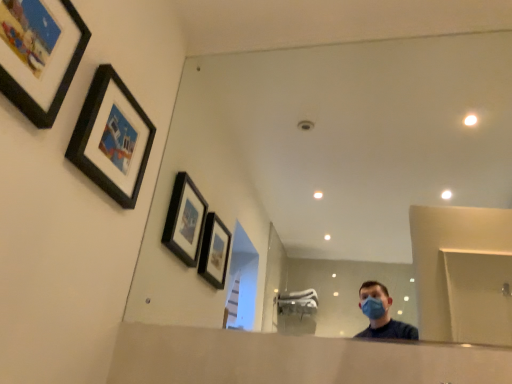
Question: Considering the relative sizes of clear glass mirror at center and matte black picture frame at upper left, arranged as the 2th picture frame when viewed from the back, in the image provided, is clear glass mirror at center bigger than matte black picture frame at upper left, arranged as the 2th picture frame when viewed from the back,?

Choices:
 (A) yes
 (B) no

Answer: (A)

Question: Does clear glass mirror at center have a smaller size compared to matte black picture frame at upper left, arranged as the 1th picture frame when viewed from the front?

Choices:
 (A) yes
 (B) no

Answer: (B)

Question: Does clear glass mirror at center have a lesser height compared to matte black picture frame at upper left, arranged as the 1th picture frame when viewed from the front?

Choices:
 (A) no
 (B) yes

Answer: (A)

Question: Is clear glass mirror at center further to camera compared to matte black picture frame at upper left, arranged as the 2th picture frame when viewed from the back?

Choices:
 (A) yes
 (B) no

Answer: (A)

Question: Is clear glass mirror at center at the left side of matte black picture frame at upper left, arranged as the 1th picture frame when viewed from the front?

Choices:
 (A) no
 (B) yes

Answer: (A)

Question: In the image, is matte black picture frame at upper left, arranged as the 2th picture frame when viewed from the back, on the left side or the right side of clear glass mirror at center?

Choices:
 (A) left
 (B) right

Answer: (A)

Question: From the image's perspective, is matte black picture frame at upper left, arranged as the 1th picture frame when viewed from the front, above or below clear glass mirror at center?

Choices:
 (A) below
 (B) above

Answer: (B)

Question: Considering their positions, is matte black picture frame at upper left, arranged as the 2th picture frame when viewed from the back, located in front of or behind clear glass mirror at center?

Choices:
 (A) behind
 (B) front

Answer: (B)

Question: Is point (83, 41) positioned closer to the camera than point (327, 187)?

Choices:
 (A) closer
 (B) farther

Answer: (A)

Question: Is clear glass mirror at center inside or outside of matte black picture frame at upper left, arranged as the 1th picture frame when viewed from the front?

Choices:
 (A) inside
 (B) outside

Answer: (B)

Question: Is clear glass mirror at center taller or shorter than matte black picture frame at upper left, arranged as the 1th picture frame when viewed from the front?

Choices:
 (A) short
 (B) tall

Answer: (B)

Question: From a real-world perspective, is clear glass mirror at center positioned above or below matte black picture frame at upper left, arranged as the 2th picture frame when viewed from the back?

Choices:
 (A) above
 (B) below

Answer: (A)

Question: From the image's perspective, is clear glass mirror at center located above or below matte black picture frame at upper left, arranged as the 2th picture frame when viewed from the back?

Choices:
 (A) above
 (B) below

Answer: (B)

Question: Is black matte picture frame at upper left, which is the second picture frame in front-to-back order, taller or shorter than matte black picture frame at upper left, arranged as the 2th picture frame when viewed from the back?

Choices:
 (A) tall
 (B) short

Answer: (B)

Question: Considering the positions of point (100, 145) and point (1, 82), is point (100, 145) closer or farther from the camera than point (1, 82)?

Choices:
 (A) farther
 (B) closer

Answer: (A)